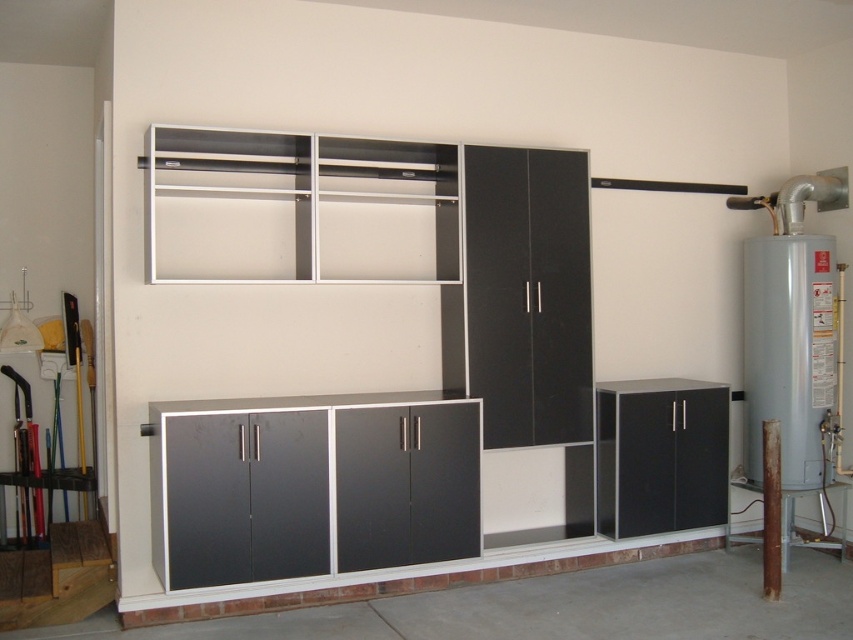
You are moving a 1.8 meter long ladder into the garage and need to place it between the white matte shelf at upper center and the matte black cabinet at lower right. Is there enough space for the ladder to fit horizontally between them?

The distance between the white matte shelf at upper center and the matte black cabinet at lower right is 1.78 meters. Since the ladder is 1.8 meters long, it is slightly longer than the available space. Therefore, the ladder will not fit horizontally between them.

You are organizing items in the garage and need to place a large tool box. You have a white matte shelf at upper center and a matte black cabinet at lower right. Which storage option has a greater width to accommodate the toolbox?

The white matte shelf at upper center has a greater width than the matte black cabinet at lower right, making it a better option for accommodating the toolbox.

You are organizing tools in the garage and need to place a heavy tool box. The white matte shelf at upper center and the matte black cabinet at lower right are available. Which storage option is suitable for the heavy tool box?

The matte black cabinet at lower right is suitable for the heavy tool box because it is located below the white matte shelf at upper center and can support heavier items.